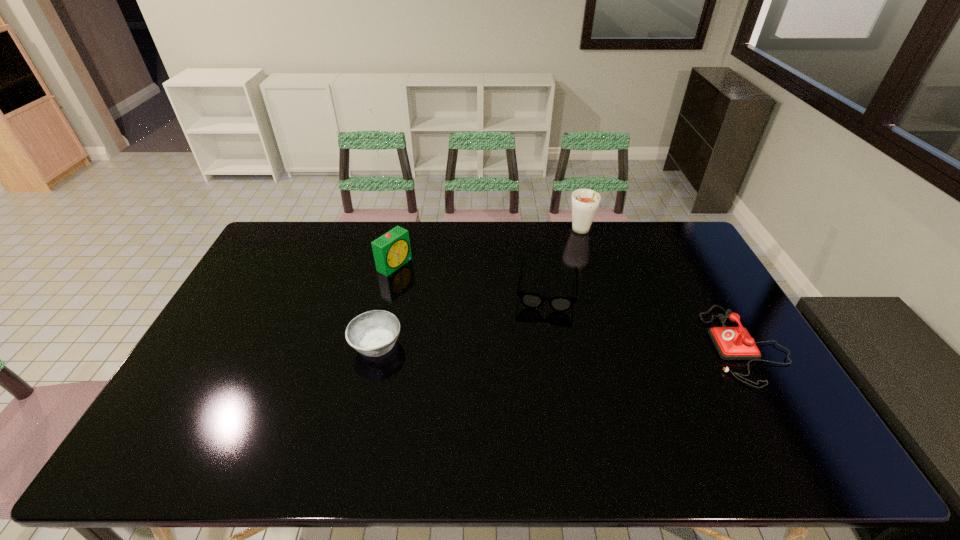
Locate an element on the screen. Image resolution: width=960 pixels, height=540 pixels. vacant space on the desktop that is between the ashtray and the telephone and is positioned on the arms of the third object from left to right is located at coordinates (542, 345).

Find the location of a particular element. The width and height of the screenshot is (960, 540). free space on the desktop that is between the ashtray and the rightmost object and is positioned on the front-facing side of the second tallest object is located at coordinates click(545, 345).

Locate an element on the screen. The height and width of the screenshot is (540, 960). free space on the desktop that is between the ashtray and the third tallest object and is positioned on the drink side of the farthest object is located at coordinates (615, 345).